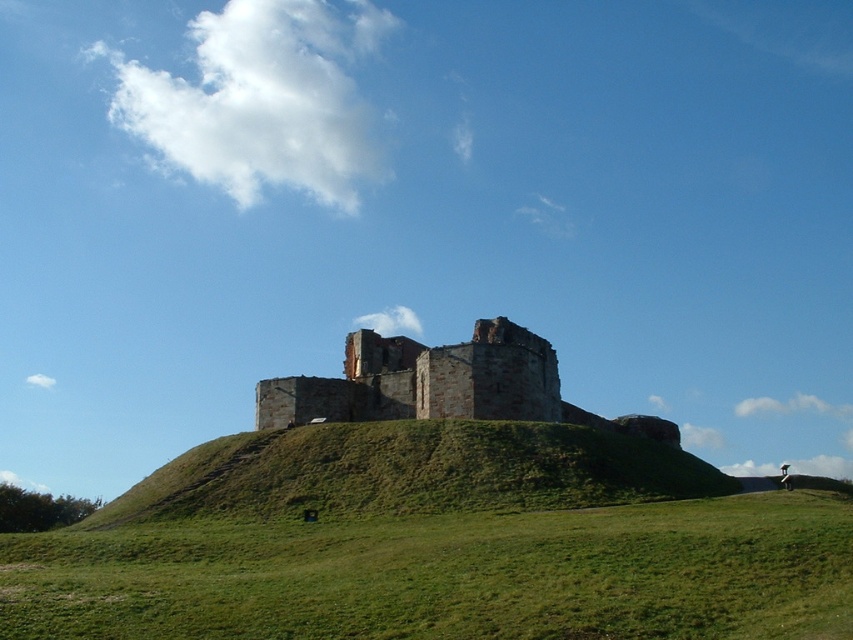
You are standing at the base of the hill looking up at the historic stone structure. There are two points marked on the image, point 1 at coordinates point (717, 548) and point 2 at coordinates point (496, 333). Which point is closer to your current position?

Point (717, 548) is closer to the camera than point (496, 333), so point 1 is closer to your current position.

You are a hiker who wants to reach the top of the hill to get a better view of the brown stone castle at center. Since you are standing on the green grassy hillside at center, which is larger in size, do you think you can find a path up the hill that avoids the castle?

The green grassy hillside at center has a larger size compared to the brown stone castle at center, so yes, you can find a path up the hill that avoids the castle since the hillside is bigger and provides more space to navigate around the castle.

You are standing at the base of the hill looking towards the historic stone structure. If you want to reach the structure, should you walk towards the green grassy hillside at center?

Yes, you should walk towards the green grassy hillside at center because it is located at point (412, 472), which is the path leading up to the historic stone structure.